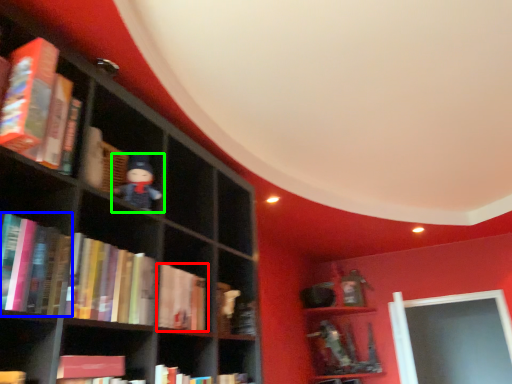
Question: Which is farther away from book (highlighted by a red box)? book (highlighted by a blue box) or toy (highlighted by a green box)?

Choices:
 (A) book
 (B) toy

Answer: (A)